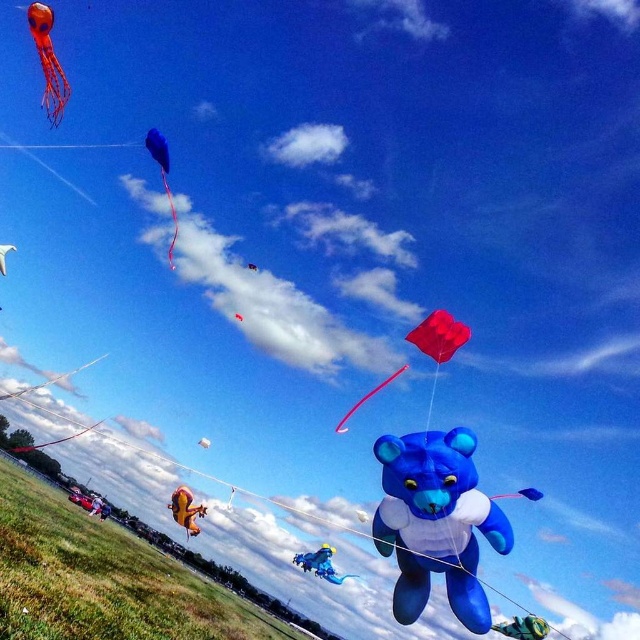
Question: Which object appears closest to the camera in this image?

Choices:
 (A) white matte kite at center
 (B) shiny metallic bear at lower right

Answer: (B)

Question: Can you confirm if yellow fabric kite at lower center is positioned to the left of blue plush bear at center?

Choices:
 (A) no
 (B) yes

Answer: (B)

Question: Can you confirm if yellow fabric kite at lower center is thinner than translucent orange jellyfish at upper left?

Choices:
 (A) no
 (B) yes

Answer: (B)

Question: In this image, where is red matte kite at center located relative to red matte kite at upper center?

Choices:
 (A) right
 (B) left

Answer: (A)

Question: Which object is the closest to the blue matte bear at center?

Choices:
 (A) blue fabric bear at center
 (B) red matte kite at upper center
 (C) shiny metallic bear at lower right

Answer: (A)

Question: Which point appears farthest from the camera in this image?

Choices:
 (A) (321, 554)
 (B) (205, 442)
 (C) (426, 499)

Answer: (B)